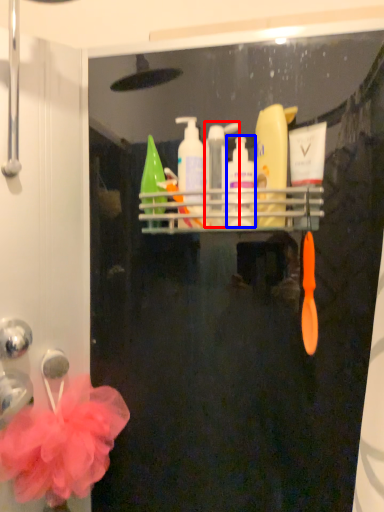
Question: Which object appears closest to the camera in this image, mouthwash (highlighted by a red box) or cleaning product (highlighted by a blue box)?

Choices:
 (A) mouthwash
 (B) cleaning product

Answer: (B)